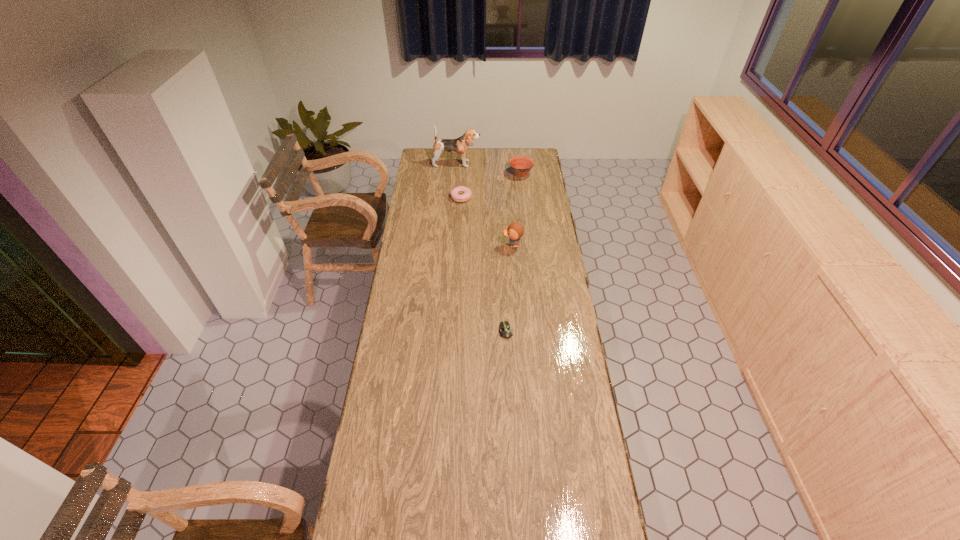
Find the location of a particular element. object present at the far right corner is located at coordinates (521, 165).

You are a GUI agent. You are given a task and a screenshot of the screen. Output one action in this format:
    pyautogui.click(x=<x>, y=<y>)
    Task: Click on the free region at the far edge of the desktop
    
    Given the screenshot: What is the action you would take?
    pyautogui.click(x=473, y=166)

In the image, there is a desktop. What are the coordinates of `blank space at the left edge` in the screenshot? It's located at (413, 235).

In the image, there is a desktop. Identify the location of vacant space at the right edge. (528, 229).

At what (x,y) coordinates should I click in order to perform the action: click on empty space that is in between the nearest object and the doughnut. Please return your answer as a coordinate pair (x, y). This screenshot has height=540, width=960. Looking at the image, I should click on (484, 264).

The image size is (960, 540). I want to click on vacant space in between the second tallest object and the computer mouse, so click(509, 288).

This screenshot has width=960, height=540. What are the coordinates of `vacant area between the shortest object and the puppy` in the screenshot? It's located at (481, 247).

In order to click on empty space between the nearest object and the third shortest object in this screenshot , I will do `click(514, 252)`.

Where is `free space that is in between the puppy and the bowl`? free space that is in between the puppy and the bowl is located at coordinates (489, 168).

Where is `free space that is in between the third nearest object and the nearest object`? free space that is in between the third nearest object and the nearest object is located at coordinates (484, 264).